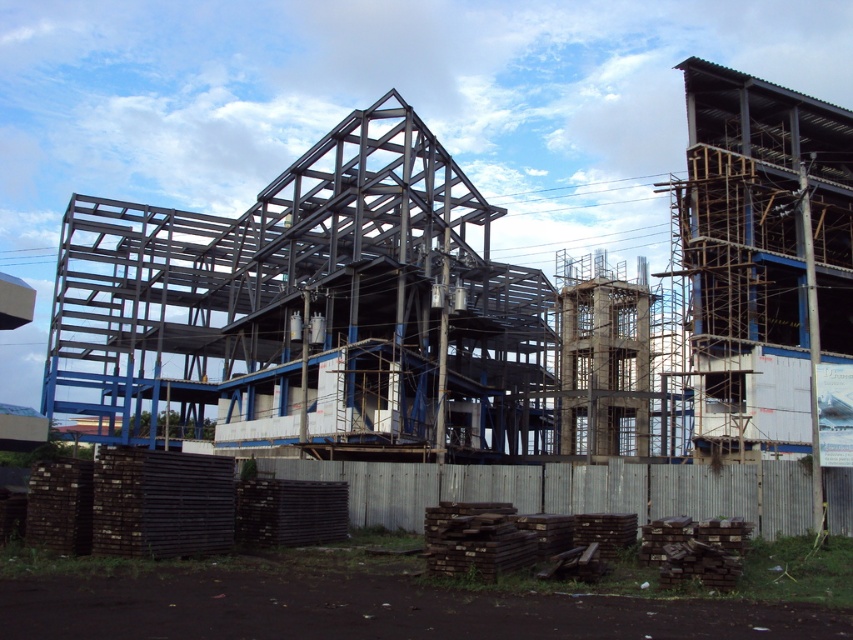
Question: Which point appears closest to the camera in this image?

Choices:
 (A) (351, 188)
 (B) (590, 488)

Answer: (B)

Question: Which point is farther from the camera taking this photo?

Choices:
 (A) (714, 484)
 (B) (274, 369)

Answer: (B)

Question: Which object is farther from the camera taking this photo?

Choices:
 (A) gray wood fence at lower center
 (B) metal framework at center

Answer: (B)

Question: Is metal framework at center positioned behind gray wood fence at lower center?

Choices:
 (A) yes
 (B) no

Answer: (A)

Question: Is metal framework at center below gray wood fence at lower center?

Choices:
 (A) no
 (B) yes

Answer: (A)

Question: Is metal framework at center to the right of gray wood fence at lower center from the viewer's perspective?

Choices:
 (A) no
 (B) yes

Answer: (A)